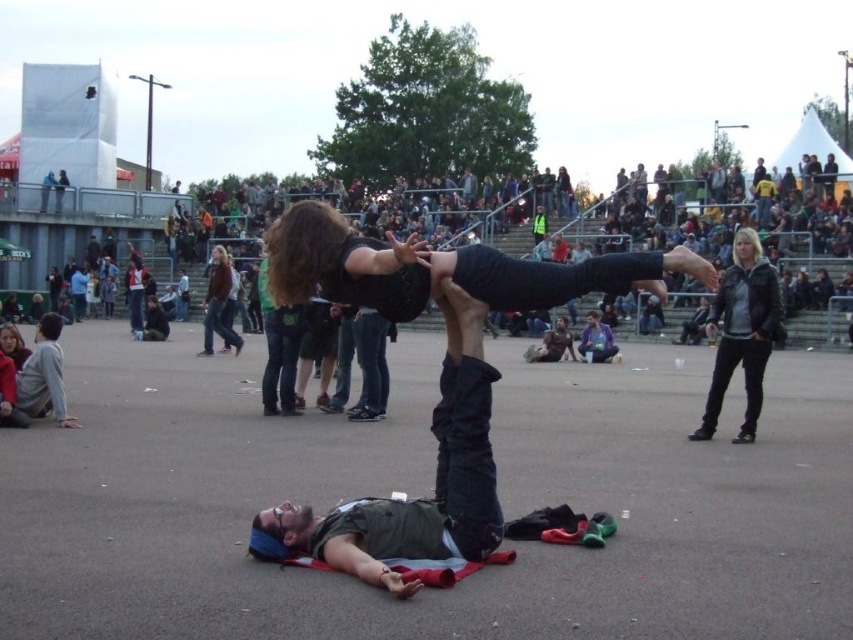
In the scene shown: You are a photographer at the event and want to capture both the black leather jacket at upper right and the light gray sweatshirt at lower left in the same frame. Which clothing item is closer to the camera?

The black leather jacket at upper right is closer to the camera because it is positioned over the light gray sweatshirt at lower left, indicating it is in front.

You are a photographer at the event and want to capture a photo where both the dark green fabric at center and the denim jacket at center are visible. Based on their heights, which object should you ensure is positioned lower in the frame to avoid blocking the other?

The dark green fabric at center is not as tall as the denim jacket at center, so you should position the dark green fabric at center lower in the frame to avoid it being blocked by the taller denim jacket at center.